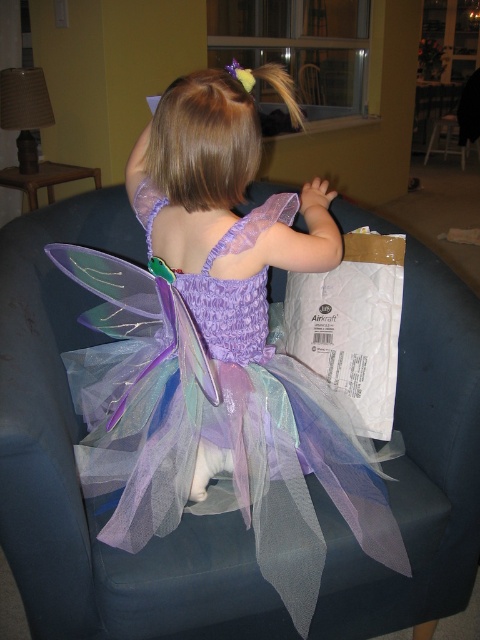
Please describe the position of the translucent tulle dress at center in the image using coordinates. The scene is a living room with a child in a fairy costume sitting on a dark blue armchair. The fairy costume includes purple and blue translucent wings with silver details, and the child has light brown hair in a ponytail with a purple and yellow accessory. The window is visible in the background. You must use the exact object label from the Objects section in your answer.

The translucent tulle dress at center is located at coordinates point (218, 353).

You are a photographer trying to capture the fairy costume from the best angle. You notice two points in the image labeled as point (207, 269) and point (377, 262). Which point is closer to the camera and should be focused on for a sharper image?

Point (207, 269) is closer to the camera than point (377, 262), so focusing on point (207, 269) will result in a sharper image.

You are a photographer setting up for a photoshoot in the living room. You need to position a light source to the right of the white paper bag at right to avoid shadows on the translucent tulle dress at center. Based on their positions, will the light source be to the left or right of the dress?

The translucent tulle dress at center is to the left of the white paper bag at right. Placing the light source to the right of the white paper bag at right means it will be further to the right of the dress. Therefore, the light source will be to the right of the translucent tulle dress at center.